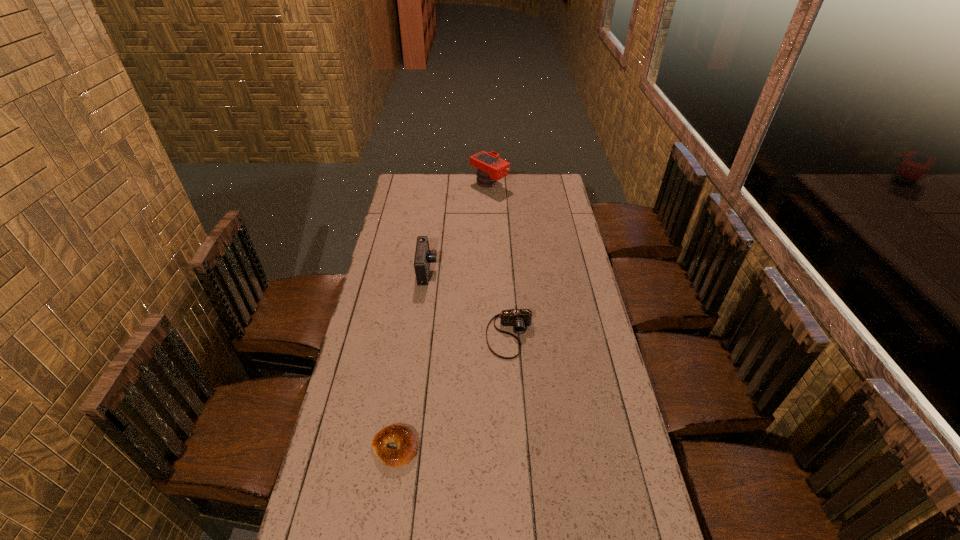
Identify the location of vacant region located 0.070m on the front-facing side of the second nearest object. (513, 376).

The height and width of the screenshot is (540, 960). I want to click on vacant space situated 0.220m on the right of the shortest object, so click(x=492, y=448).

This screenshot has height=540, width=960. Find the location of `object that is at the far edge`. object that is at the far edge is located at coordinates (490, 167).

Find the location of `object present at the left edge`. object present at the left edge is located at coordinates (401, 435).

Where is `vacant space at the far edge of the desktop`? The height and width of the screenshot is (540, 960). vacant space at the far edge of the desktop is located at coordinates (481, 192).

This screenshot has width=960, height=540. I want to click on free space at the left edge of the desktop, so click(x=398, y=249).

The width and height of the screenshot is (960, 540). Identify the location of vacant space at the right edge of the desktop. (562, 215).

Where is `blank space at the far left corner of the desktop`? This screenshot has width=960, height=540. blank space at the far left corner of the desktop is located at coordinates (412, 194).

I want to click on free space at the far right corner of the desktop, so click(559, 177).

Locate an element on the screen. This screenshot has width=960, height=540. blank region between the second nearest object and the second farthest camera is located at coordinates (468, 303).